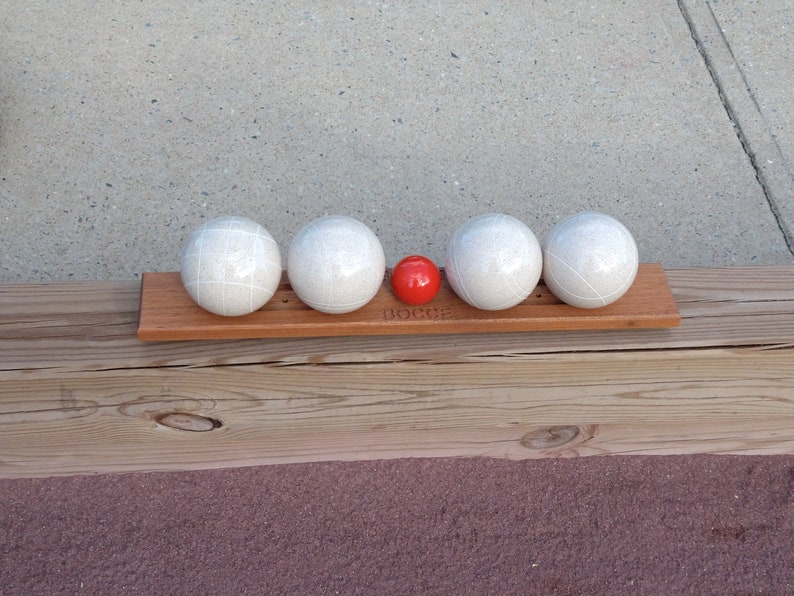
In order to click on wooden box in this screenshot , I will do [x=479, y=402].